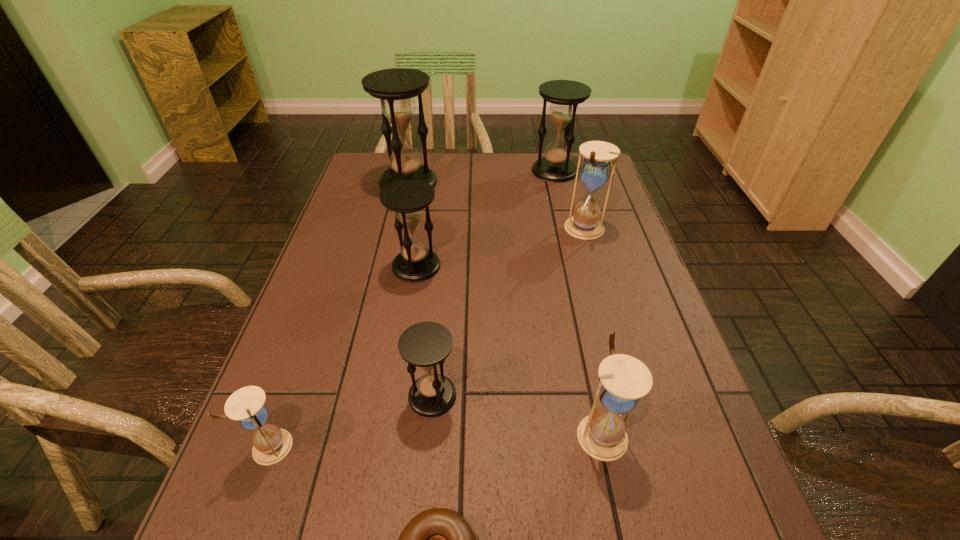
In the image, there is a desktop. Find the location of `vacant space at the far edge`. vacant space at the far edge is located at coordinates (510, 173).

In the image, there is a desktop. Identify the location of vacant space at the near edge. Image resolution: width=960 pixels, height=540 pixels. (514, 538).

This screenshot has height=540, width=960. I want to click on blank space at the left edge, so click(x=257, y=495).

Find the location of a particular element. free space at the right edge of the desktop is located at coordinates (679, 396).

Locate an element on the screen. The image size is (960, 540). vacant space at the far left corner of the desktop is located at coordinates (371, 167).

Image resolution: width=960 pixels, height=540 pixels. In order to click on vacant point located between the rightmost black hourglass and the leftmost object in this screenshot , I will do `click(413, 308)`.

I want to click on empty space that is in between the fourth nearest hourglass and the rightmost black hourglass, so click(486, 218).

Identify the location of free area in between the smallest black hourglass and the rightmost black hourglass. The image size is (960, 540). (493, 283).

Identify the location of free space between the sixth nearest object and the rightmost black hourglass. The height and width of the screenshot is (540, 960). (570, 200).

The image size is (960, 540). What are the coordinates of `free space between the nearest black hourglass and the tallest hourglass` in the screenshot? It's located at (420, 289).